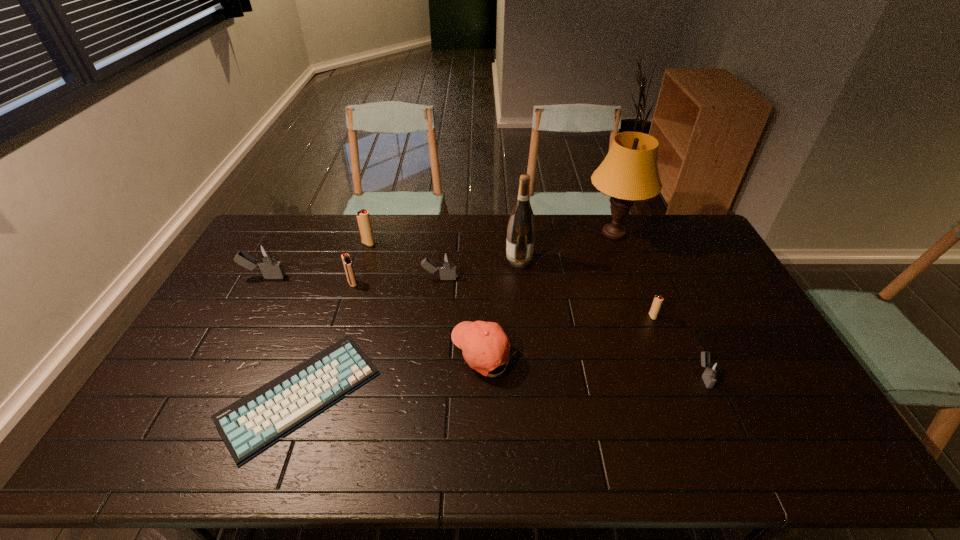
Identify the location of free location located on the front of the farthest igniter. The height and width of the screenshot is (540, 960). (356, 284).

Locate an element on the screen. The height and width of the screenshot is (540, 960). free space located 0.100m on the back of the leftmost gray igniter is located at coordinates (278, 252).

Image resolution: width=960 pixels, height=540 pixels. What are the coordinates of `free space located on the front of the second biggest gray igniter` in the screenshot? It's located at (438, 295).

Where is `free location located 0.180m on the left of the second smallest red igniter`? This screenshot has height=540, width=960. free location located 0.180m on the left of the second smallest red igniter is located at coordinates (294, 284).

The height and width of the screenshot is (540, 960). I want to click on free space located on the back of the baseball cap, so click(482, 259).

The height and width of the screenshot is (540, 960). I want to click on vacant point located 0.310m on the right of the nearest red igniter, so click(x=755, y=316).

Find the location of a particular element. This screenshot has width=960, height=540. vacant space located on the back of the rightmost gray igniter is located at coordinates [662, 284].

Locate an element on the screen. free space located on the left of the gray computer keyboard is located at coordinates (153, 397).

Identify the location of lampshade present at the far edge. Image resolution: width=960 pixels, height=540 pixels. (629, 172).

Find the location of `igniter at the far edge`. igniter at the far edge is located at coordinates (362, 216).